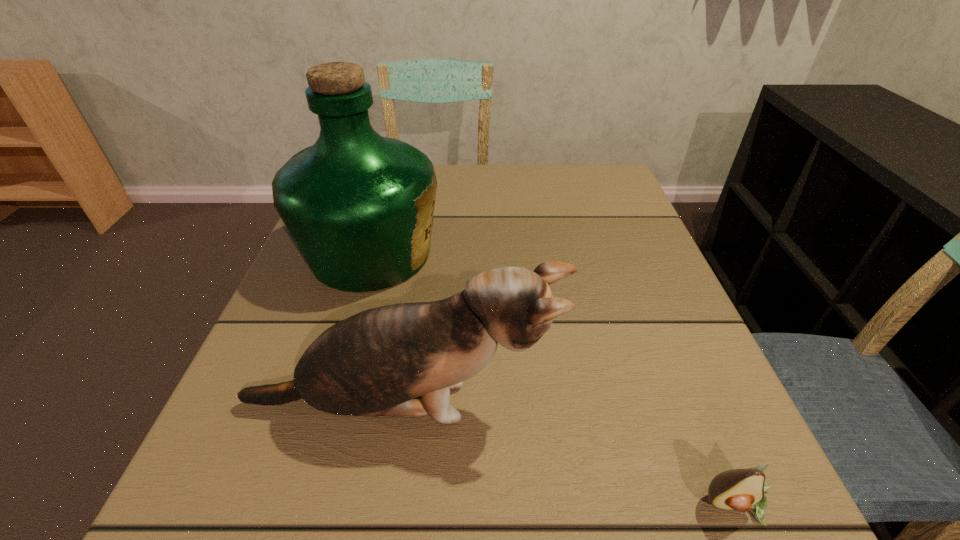
Where is `the tallest object`? This screenshot has height=540, width=960. the tallest object is located at coordinates (359, 206).

Where is `the farthest object`? The height and width of the screenshot is (540, 960). the farthest object is located at coordinates (359, 206).

This screenshot has height=540, width=960. I want to click on the second farthest object, so click(x=377, y=362).

In order to click on cat in this screenshot , I will do `click(377, 362)`.

Image resolution: width=960 pixels, height=540 pixels. I want to click on the shortest object, so click(743, 490).

Identify the location of avocado. (743, 490).

The height and width of the screenshot is (540, 960). Find the location of `vacant space located on the label side of the liquor`. vacant space located on the label side of the liquor is located at coordinates (495, 254).

The image size is (960, 540). Identify the location of vacant space situated at the face of the second farthest object. (655, 406).

The width and height of the screenshot is (960, 540). In order to click on object present at the near edge in this screenshot , I will do `click(743, 490)`.

Find the location of a particular element. liquor that is at the left edge is located at coordinates (359, 206).